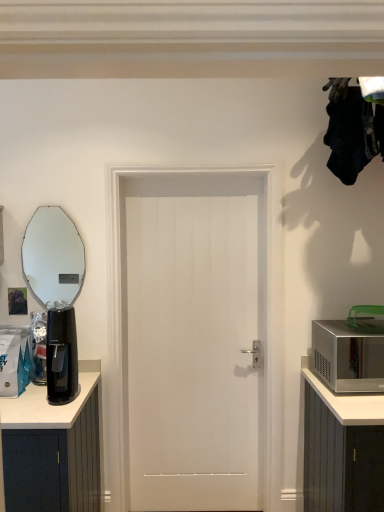
Question: From the image's perspective, would you say black plastic coffee maker at left is positioned over silver metallic microwave at right?

Choices:
 (A) yes
 (B) no

Answer: (A)

Question: Could you tell me if black plastic coffee maker at left is facing silver metallic microwave at right?

Choices:
 (A) yes
 (B) no

Answer: (B)

Question: Are black plastic coffee maker at left and silver metallic microwave at right beside each other?

Choices:
 (A) no
 (B) yes

Answer: (A)

Question: Can you confirm if black plastic coffee maker at left is taller than silver metallic microwave at right?

Choices:
 (A) no
 (B) yes

Answer: (B)

Question: Does black plastic coffee maker at left have a lesser height compared to silver metallic microwave at right?

Choices:
 (A) no
 (B) yes

Answer: (A)

Question: Would you consider black plastic coffee maker at left to be distant from silver metallic microwave at right?

Choices:
 (A) yes
 (B) no

Answer: (A)

Question: Is silver metallic microwave at right far from black plastic coffee maker at left?

Choices:
 (A) yes
 (B) no

Answer: (A)

Question: Is black plastic coffee maker at left surrounded by silver metallic microwave at right?

Choices:
 (A) yes
 (B) no

Answer: (B)

Question: From the image's perspective, is silver metallic microwave at right below black plastic coffee maker at left?

Choices:
 (A) yes
 (B) no

Answer: (A)

Question: Is the position of silver metallic microwave at right more distant than that of black plastic coffee maker at left?

Choices:
 (A) no
 (B) yes

Answer: (B)

Question: Could you tell me if silver metallic microwave at right is turned towards black plastic coffee maker at left?

Choices:
 (A) no
 (B) yes

Answer: (A)

Question: Can you confirm if silver metallic microwave at right is smaller than black plastic coffee maker at left?

Choices:
 (A) no
 (B) yes

Answer: (A)

Question: Is black plastic coffee maker at left oriented towards white smooth door at center?

Choices:
 (A) no
 (B) yes

Answer: (A)